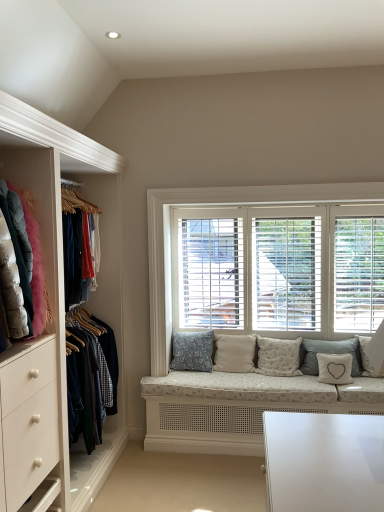
Question: In which direction should I rotate to look at fluffy white pillow at center, which appears as the sixth pillow when viewed from the left?

Choices:
 (A) left
 (B) right

Answer: (B)

Question: Can you confirm if light gray fabric pillow at center, which is counted as the second pillow, starting from the right, is positioned to the right of velvet jackets at left?

Choices:
 (A) yes
 (B) no

Answer: (A)

Question: From the image's perspective, does light gray fabric pillow at center, which is counted as the second pillow, starting from the right, appear higher than velvet jackets at left?

Choices:
 (A) yes
 (B) no

Answer: (B)

Question: From a real-world perspective, is light gray fabric pillow at center, which is counted as the second pillow, starting from the right, beneath velvet jackets at left?

Choices:
 (A) yes
 (B) no

Answer: (A)

Question: Could you tell me if light gray fabric pillow at center, which is counted as the second pillow, starting from the right, is turned towards velvet jackets at left?

Choices:
 (A) yes
 (B) no

Answer: (B)

Question: Can you confirm if light gray fabric pillow at center, which is counted as the second pillow, starting from the right, is taller than velvet jackets at left?

Choices:
 (A) no
 (B) yes

Answer: (A)

Question: Is light gray fabric pillow at center, which is counted as the second pillow, starting from the right, directly adjacent to velvet jackets at left?

Choices:
 (A) yes
 (B) no

Answer: (B)

Question: From a real-world perspective, is blue textured cushion at center, marked as the sixth pillow in a right-to-left arrangement, located beneath white wood blinds at center?

Choices:
 (A) yes
 (B) no

Answer: (A)

Question: Can you confirm if blue textured cushion at center, the first pillow when ordered from left to right, is thinner than white wood blinds at center?

Choices:
 (A) no
 (B) yes

Answer: (A)

Question: Considering the relative positions of blue textured cushion at center, marked as the sixth pillow in a right-to-left arrangement, and white wood blinds at center in the image provided, is blue textured cushion at center, marked as the sixth pillow in a right-to-left arrangement, to the right of white wood blinds at center from the viewer's perspective?

Choices:
 (A) no
 (B) yes

Answer: (A)

Question: From a real-world perspective, is blue textured cushion at center, marked as the sixth pillow in a right-to-left arrangement, on white wood blinds at center?

Choices:
 (A) no
 (B) yes

Answer: (A)

Question: Is blue textured cushion at center, marked as the sixth pillow in a right-to-left arrangement, positioned far away from white wood blinds at center?

Choices:
 (A) yes
 (B) no

Answer: (B)

Question: Is white wood blinds at center surrounded by blue textured cushion at center, the first pillow when ordered from left to right?

Choices:
 (A) yes
 (B) no

Answer: (B)

Question: Is fluffy white pillow at center, the fourth pillow from the right, oriented towards beige fabric cushion at center, acting as the 2th pillow starting from the left?

Choices:
 (A) no
 (B) yes

Answer: (A)